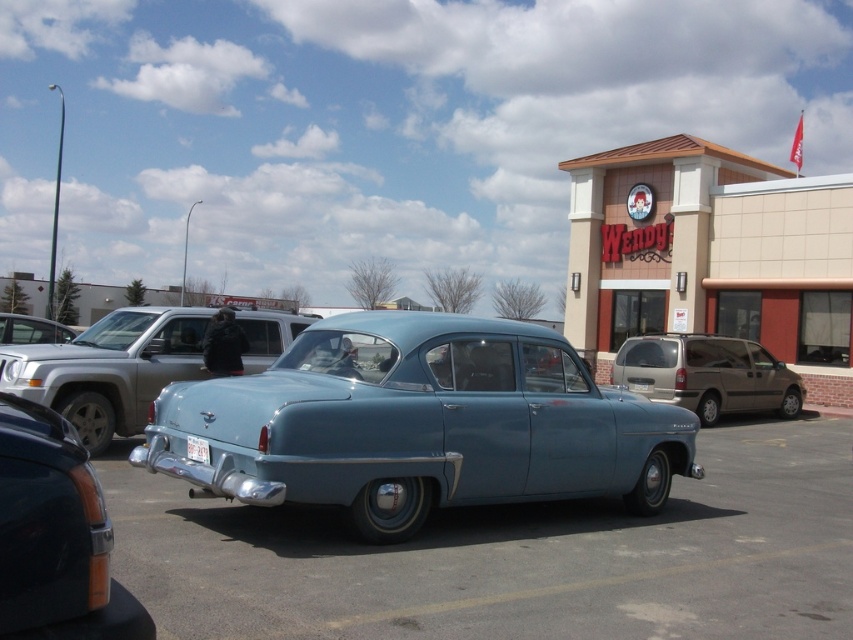
You are a delivery person who needs to load a package onto the roof of the light blue matte car at center. The package requires a minimum clearance of 2 meters to avoid damage. Can you determine if the white plastic license plate at center will interfere with the package?

The light blue matte car at center has a greater height compared to white plastic license plate at center, so the license plate is lower than the car. Since the package requires 2 meters of clearance, the license plate at the car center won